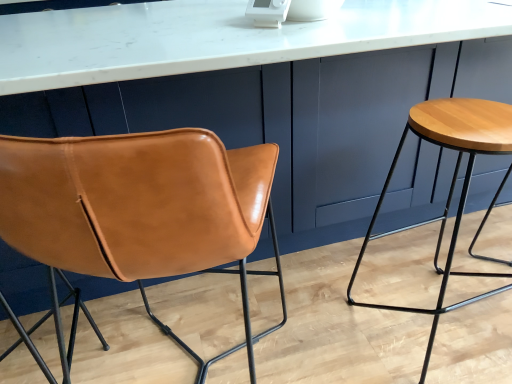
Question: Considering the positions of point (7, 178) and point (368, 233), is point (7, 178) closer or farther from the camera than point (368, 233)?

Choices:
 (A) farther
 (B) closer

Answer: (B)

Question: Considering the relative positions of cognac leather chair at left and wooden stool at right in the image provided, is cognac leather chair at left to the left or to the right of wooden stool at right?

Choices:
 (A) left
 (B) right

Answer: (A)

Question: Which object is positioned farthest from the wooden stool at right?

Choices:
 (A) white marble countertop at center
 (B) cognac leather chair at left

Answer: (B)

Question: Based on their relative distances, which object is nearer to the wooden stool at right?

Choices:
 (A) white marble countertop at center
 (B) cognac leather chair at left

Answer: (A)